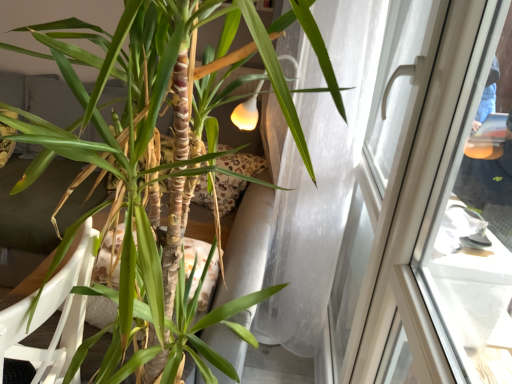
Question: Should I look upward or downward to see transparent glass window at upper right?

Choices:
 (A) down
 (B) up

Answer: (A)

Question: Could you tell me if transparent glass window at upper right is facing green matte plant at center?

Choices:
 (A) yes
 (B) no

Answer: (B)

Question: Can you confirm if transparent glass window at upper right is taller than green matte plant at center?

Choices:
 (A) yes
 (B) no

Answer: (A)

Question: Would you say green matte plant at center is part of transparent glass window at upper right's contents?

Choices:
 (A) no
 (B) yes

Answer: (A)

Question: Is transparent glass window at upper right positioned with its back to green matte plant at center?

Choices:
 (A) yes
 (B) no

Answer: (B)

Question: Is transparent glass window at upper right smaller than green matte plant at center?

Choices:
 (A) no
 (B) yes

Answer: (B)

Question: From the image's perspective, would you say transparent glass window at upper right is positioned over green matte plant at center?

Choices:
 (A) yes
 (B) no

Answer: (A)

Question: From the image's perspective, is white plastic armchair at lower left below green matte plant at center?

Choices:
 (A) yes
 (B) no

Answer: (A)

Question: Considering the relative positions of white plastic armchair at lower left and green matte plant at center in the image provided, is white plastic armchair at lower left behind green matte plant at center?

Choices:
 (A) yes
 (B) no

Answer: (A)

Question: Is white plastic armchair at lower left not within green matte plant at center?

Choices:
 (A) no
 (B) yes

Answer: (A)

Question: Considering the relative sizes of white plastic armchair at lower left and green matte plant at center in the image provided, is white plastic armchair at lower left taller than green matte plant at center?

Choices:
 (A) no
 (B) yes

Answer: (A)

Question: Can you confirm if white plastic armchair at lower left is thinner than green matte plant at center?

Choices:
 (A) yes
 (B) no

Answer: (A)

Question: Is white plastic armchair at lower left next to green matte plant at center?

Choices:
 (A) no
 (B) yes

Answer: (A)

Question: Considering the relative sizes of transparent glass window at upper right and white plastic armchair at lower left in the image provided, is transparent glass window at upper right bigger than white plastic armchair at lower left?

Choices:
 (A) yes
 (B) no

Answer: (B)